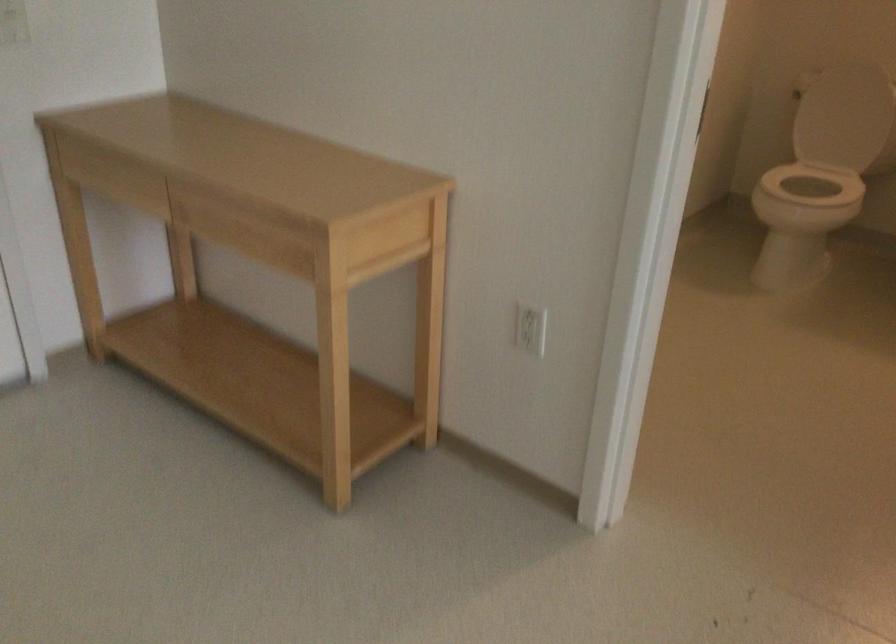
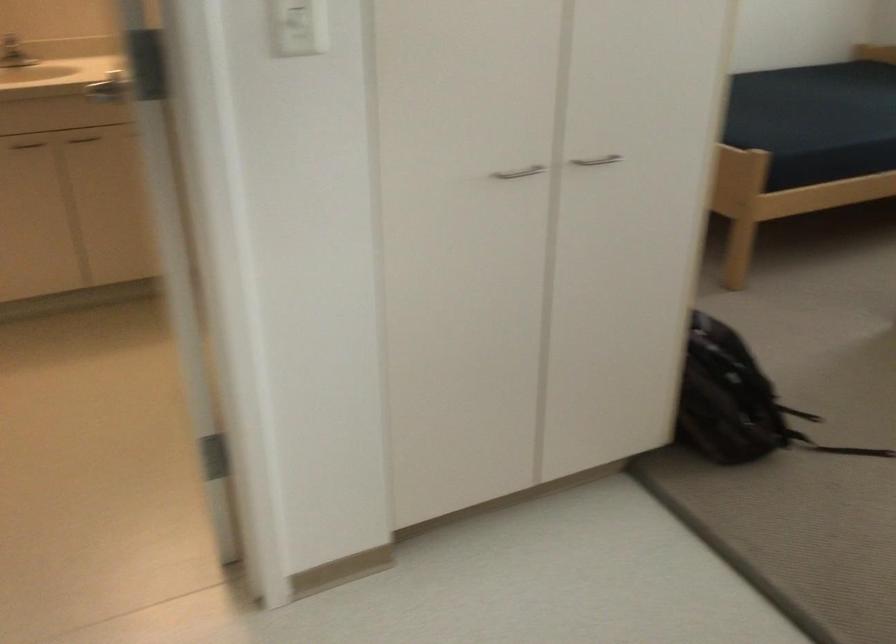
Question: The camera is either moving clockwise (left) or counter-clockwise (right) around the object. The first image is from the beginning of the video and the second image is from the end. Is the camera moving left or right when shooting the video?

Choices:
 (A) Left
 (B) Right

Answer: (A)